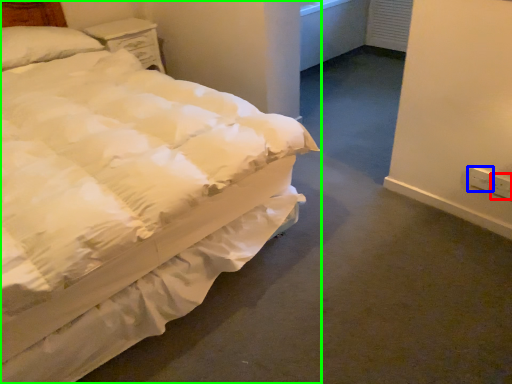
Question: Which object is positioned closest to electric outlet (highlighted by a red box)? Select from electric outlet (highlighted by a blue box) and bed (highlighted by a green box).

Choices:
 (A) electric outlet
 (B) bed

Answer: (A)